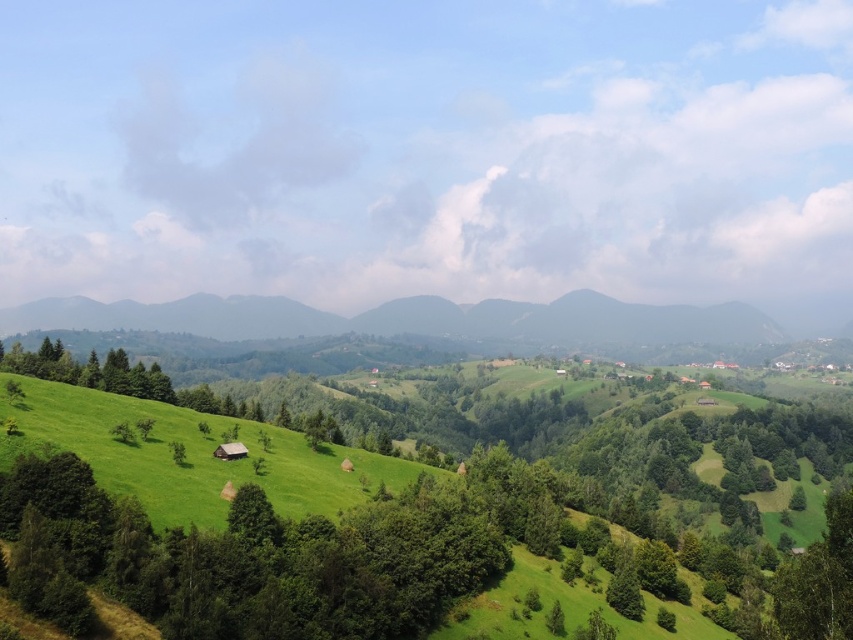
Does green leafy tree at center appear on the left side of green grassy field at lower left?

Incorrect, green leafy tree at center is not on the left side of green grassy field at lower left.

Locate an element on the screen. This screenshot has width=853, height=640. green leafy tree at center is located at coordinates 412,522.

I want to click on green leafy tree at center, so click(x=412, y=522).